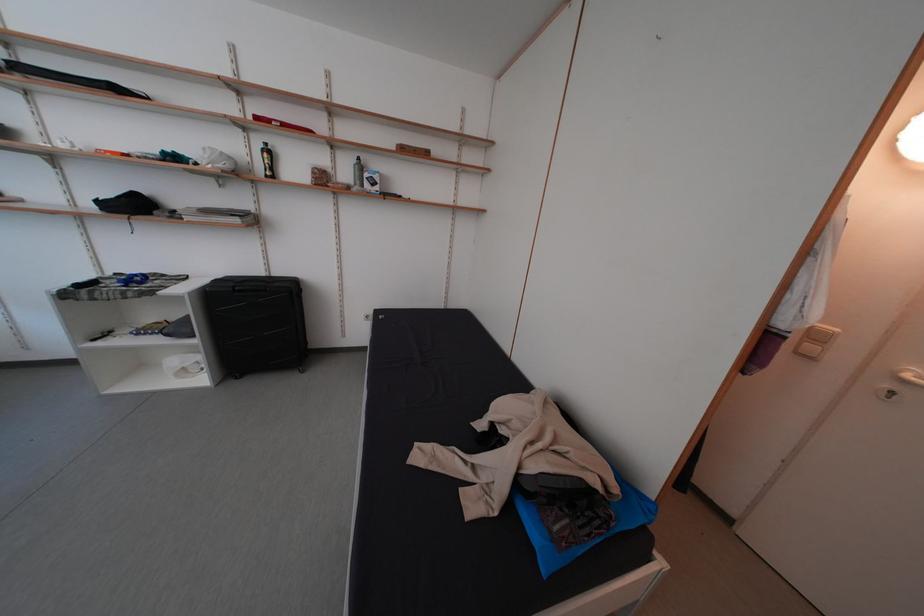
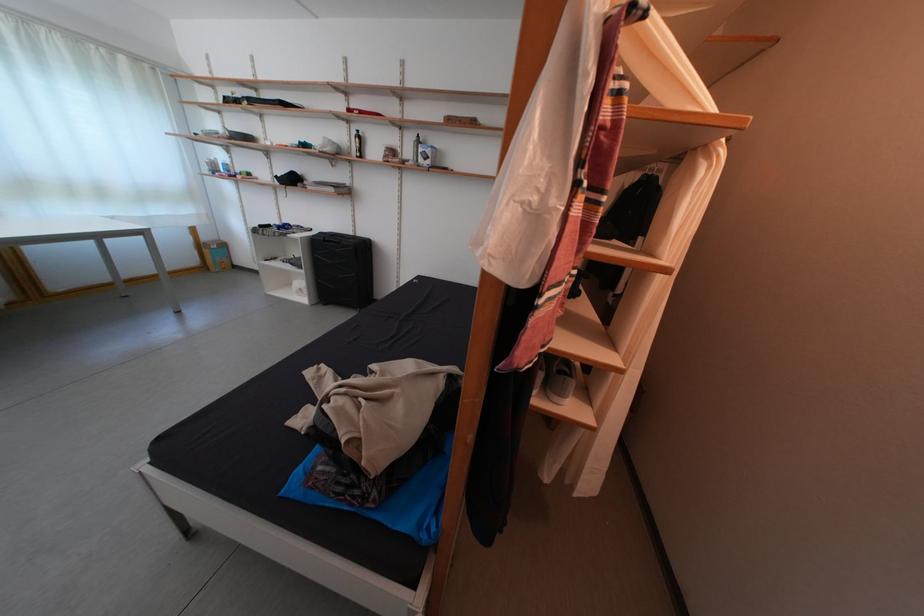
Question: Based on the continuous images, in which direction is the camera rotating? Reply with the corresponding letter.

Choices:
 (A) Left
 (B) Right
 (C) Up
 (D) Down

Answer: (A)